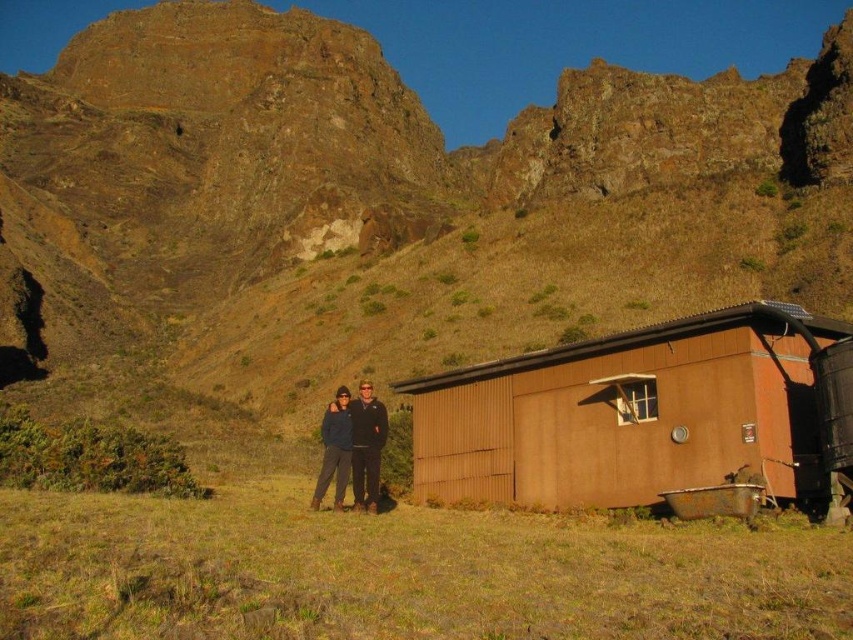
Question: Is brown corrugated metal cabin at right smaller than dark blue jacket at center?

Choices:
 (A) no
 (B) yes

Answer: (A)

Question: Which point is farther to the camera?

Choices:
 (A) (566, 394)
 (B) (335, 404)

Answer: (A)

Question: Which point is closer to the camera taking this photo?

Choices:
 (A) pyautogui.click(x=561, y=486)
 (B) pyautogui.click(x=328, y=420)

Answer: (A)

Question: Can you confirm if brown corrugated metal cabin at right is positioned to the right of dark blue jacket at center?

Choices:
 (A) yes
 (B) no

Answer: (A)

Question: Can you confirm if brown corrugated metal cabin at right is thinner than dark blue jacket at center?

Choices:
 (A) no
 (B) yes

Answer: (A)